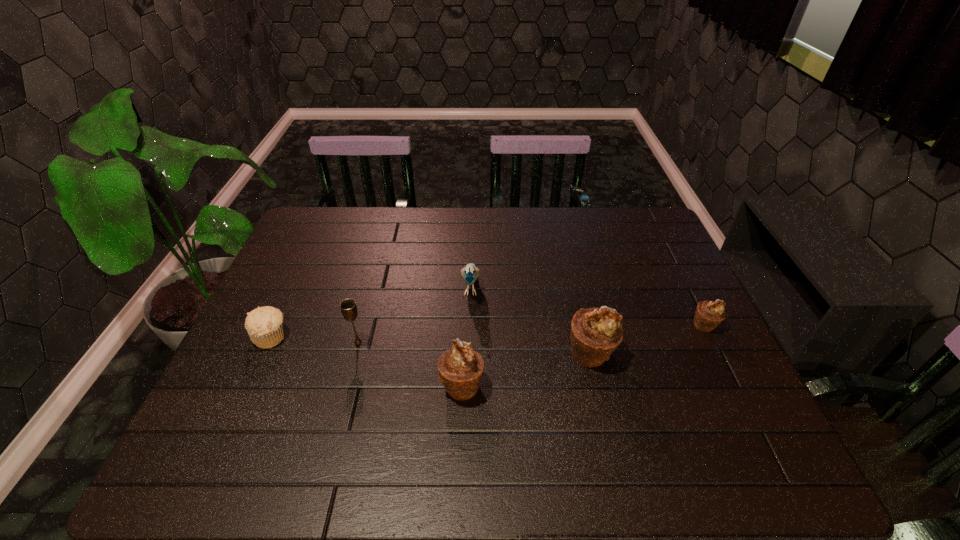
Locate an element on the screen. The width and height of the screenshot is (960, 540). free space located at the face of the farthest object is located at coordinates (469, 337).

Where is `free location located 0.120m on the back of the leftmost object`? Image resolution: width=960 pixels, height=540 pixels. free location located 0.120m on the back of the leftmost object is located at coordinates (292, 293).

You are a GUI agent. You are given a task and a screenshot of the screen. Output one action in this format:
    pyautogui.click(x=<x>, y=<y>)
    Task: Click on the object located in the near edge section of the desktop
    The image size is (960, 540).
    Given the screenshot: What is the action you would take?
    pyautogui.click(x=460, y=369)

The height and width of the screenshot is (540, 960). I want to click on object situated at the left edge, so click(264, 325).

Find the location of `object present at the right edge`. object present at the right edge is located at coordinates (708, 314).

Where is `vacant space at the far edge of the desktop`? vacant space at the far edge of the desktop is located at coordinates (453, 235).

This screenshot has height=540, width=960. What are the coordinates of `vacant space at the near edge of the desktop` in the screenshot? It's located at (348, 424).

Where is `free space at the left edge of the desktop`? free space at the left edge of the desktop is located at coordinates (284, 285).

The height and width of the screenshot is (540, 960). In the image, there is a desktop. In order to click on vacant region at the right edge in this screenshot , I will do `click(656, 316)`.

Locate an element on the screen. vacant region at the far left corner of the desktop is located at coordinates (314, 211).